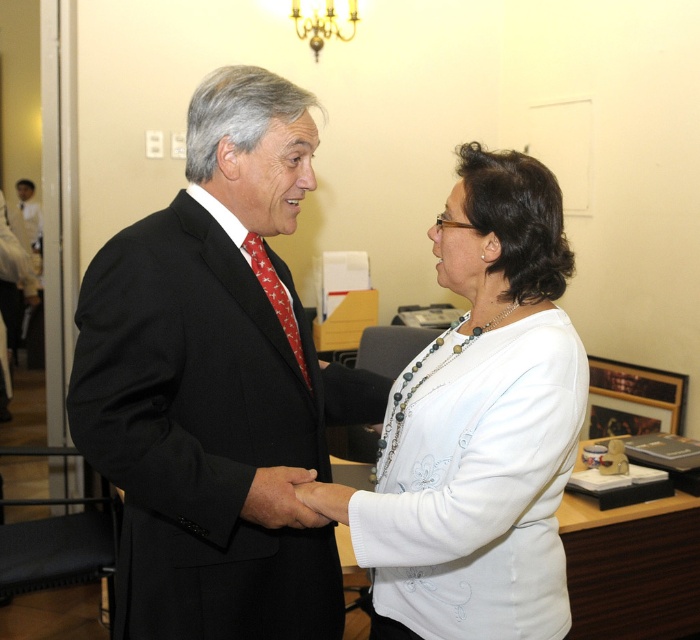
Question: Which of the following is the closest to the observer?

Choices:
 (A) [294, 492]
 (B) [567, 353]
 (C) [342, 522]
 (D) [88, 387]

Answer: (B)

Question: Does black suit at center have a lesser width compared to white matte sweater at center?

Choices:
 (A) yes
 (B) no

Answer: (B)

Question: Estimate the real-world distances between objects in this image. Which object is closer to the black suit at center?

Choices:
 (A) white matte sweater at center
 (B) white matte hand at center
 (C) smooth skin hand at center

Answer: (C)

Question: Is smooth skin hand at center in front of white matte hand at center?

Choices:
 (A) yes
 (B) no

Answer: (B)

Question: Is smooth skin hand at center closer to the viewer compared to white matte hand at center?

Choices:
 (A) no
 (B) yes

Answer: (A)

Question: Which point is farther to the camera?

Choices:
 (A) white matte sweater at center
 (B) black suit at center
 (C) white matte hand at center

Answer: (C)